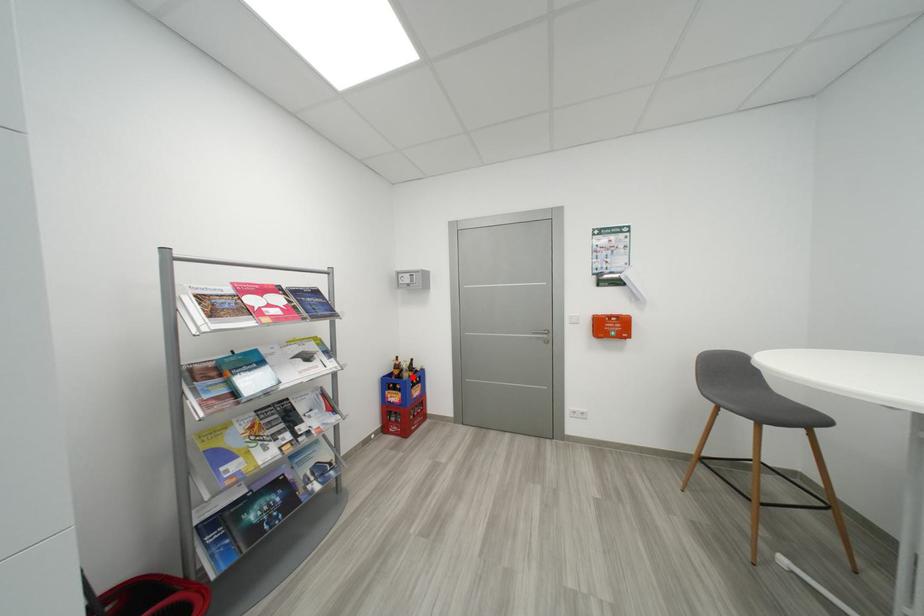
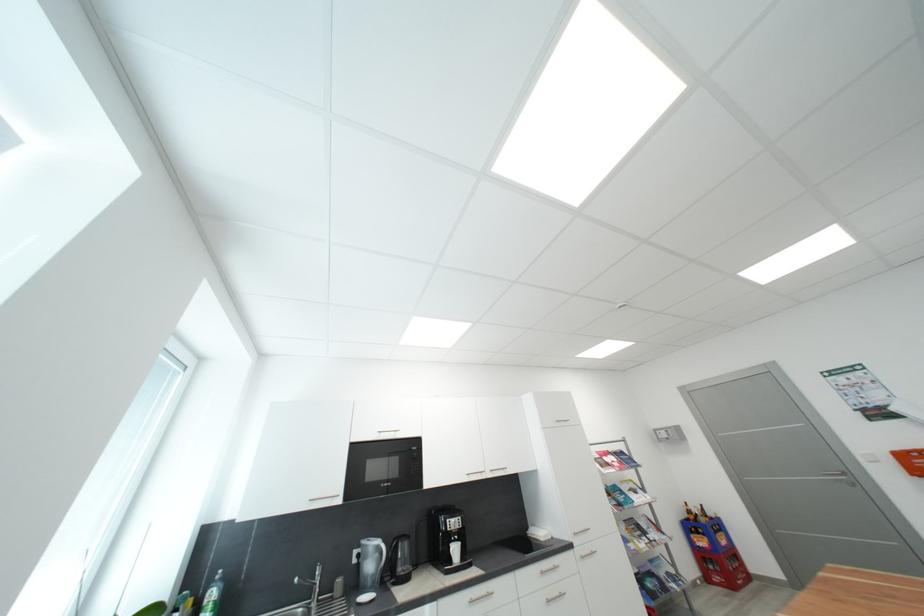
Find the pixel in the second image that matches the highlighted location in the first image.

(710, 522)